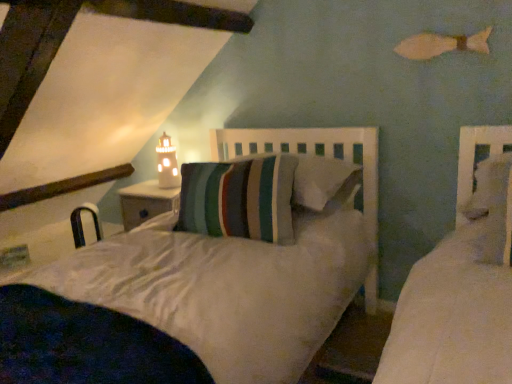
Question: Is white ceramic lighthouse at upper center spatially inside metallic silver chair at lower left, or outside of it?

Choices:
 (A) outside
 (B) inside

Answer: (A)

Question: Considering the positions of point (163, 180) and point (74, 220), is point (163, 180) closer or farther from the camera than point (74, 220)?

Choices:
 (A) farther
 (B) closer

Answer: (B)

Question: Estimate the real-world distances between objects in this image. Which object is farther from the white ceramic lighthouse at upper center?

Choices:
 (A) metallic silver chair at lower left
 (B) striped fabric pillow at center

Answer: (B)

Question: Based on their relative distances, which object is nearer to the metallic silver chair at lower left?

Choices:
 (A) white ceramic lighthouse at upper center
 (B) striped fabric pillow at center

Answer: (A)